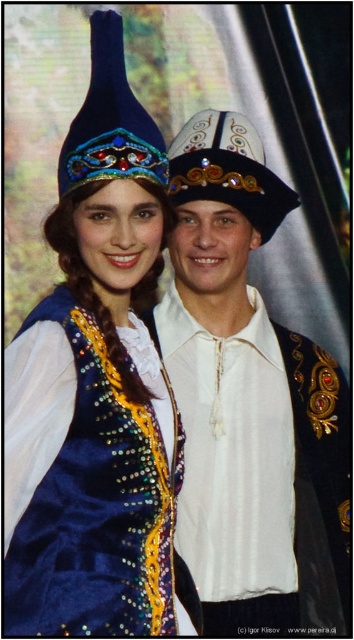
You are a photographer adjusting the focus on your camera. You notice two points in the image at coordinates point (133, 154) and point (179, 138). Which point should you focus on to ensure it appears sharper in the photo?

Point (133, 154) is closer to the camera than point (179, 138), so focusing on point (133, 154) will make it appear sharper in the photo.

Consider the image. You are a photographer planning to take a portrait of two people wearing the velvet blue dress at center and the white satin shirt at center. You want to ensure the clothing details are clearly visible. Which clothing item should you focus on more to capture its intricate embroidery and patterns?

The velvet blue dress at center is thinner than the white satin shirt at center, so focusing on the white satin shirt at center will better capture its intricate embroidery and patterns since thicker fabrics often have more defined details.